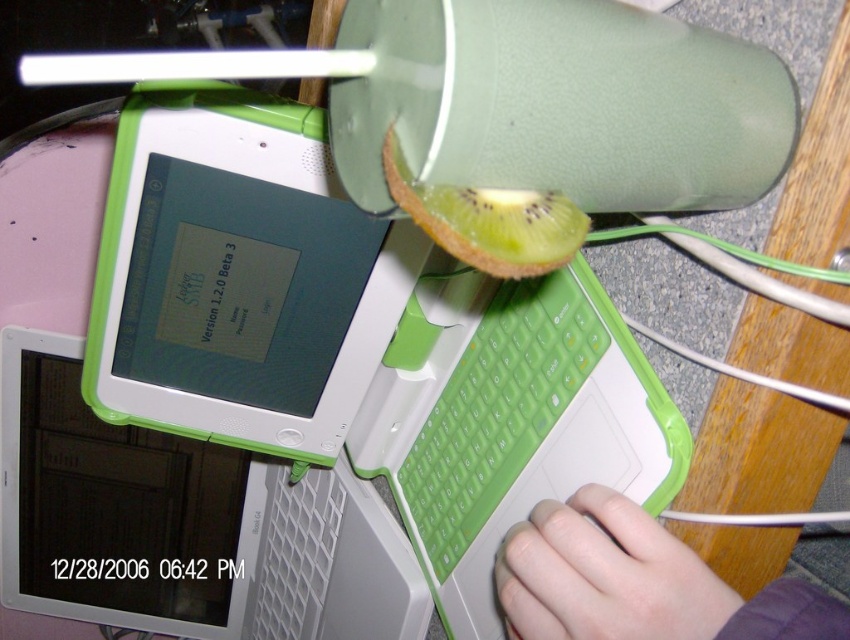
Is green plastic laptop at center bigger than green textured kiwi at upper center?

Yes.

Which is more to the left, green plastic laptop at center or green textured kiwi at upper center?

Positioned to the left is green plastic laptop at center.

Does point (612, 442) lie in front of point (527, 211)?

No, it is behind (527, 211).

Where is `green plastic laptop at center`? This screenshot has width=850, height=640. green plastic laptop at center is located at coordinates (366, 355).

Is smooth skin hand at lower right below green textured kiwi at upper center?

Correct, smooth skin hand at lower right is located below green textured kiwi at upper center.

Which is in front, point (714, 636) or point (429, 224)?

Point (429, 224)

This screenshot has height=640, width=850. I want to click on smooth skin hand at lower right, so click(x=636, y=582).

Between smooth skin hand at lower right and green rubberized keyboard at center, which one has less height?

With less height is smooth skin hand at lower right.

Is point (738, 609) positioned behind point (519, 436)?

That is False.

Is point (701, 600) positioned after point (564, 304)?

No, (701, 600) is in front of (564, 304).

I want to click on smooth skin hand at lower right, so click(636, 582).